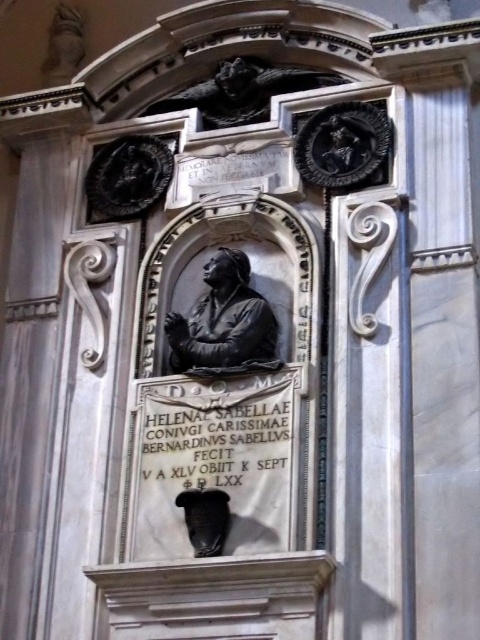
Question: Estimate the real-world distances between objects in this image. Which object is closer to the matte black bust at lower center?

Choices:
 (A) black stone gargoyle at upper center
 (B) black polished stone statue at center

Answer: (B)

Question: Which point is closer to the camera taking this photo?

Choices:
 (A) (242, 352)
 (B) (228, 60)
 (C) (202, 556)

Answer: (C)

Question: Among these objects, which one is farthest from the camera?

Choices:
 (A) black polished stone statue at center
 (B) black stone gargoyle at upper center

Answer: (B)

Question: Observing the image, what is the correct spatial positioning of black polished stone statue at center in reference to black stone gargoyle at upper center?

Choices:
 (A) above
 (B) below

Answer: (B)

Question: Does black polished stone statue at center have a greater width compared to matte black bust at lower center?

Choices:
 (A) no
 (B) yes

Answer: (A)

Question: Can you confirm if black polished stone statue at center is bigger than black stone gargoyle at upper center?

Choices:
 (A) yes
 (B) no

Answer: (A)